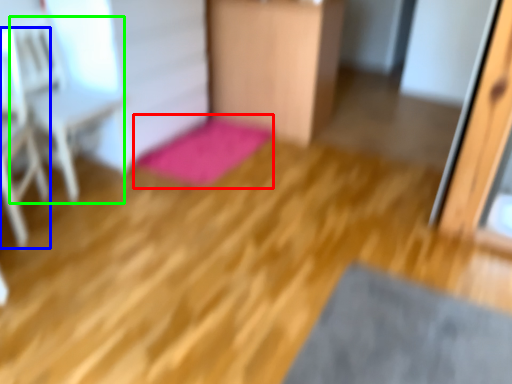
Question: Estimate the real-world distances between objects in this image. Which object is closer to bath mat (highlighted by a red box), armchair (highlighted by a blue box) or armchair (highlighted by a green box)?

Choices:
 (A) armchair
 (B) armchair

Answer: (B)